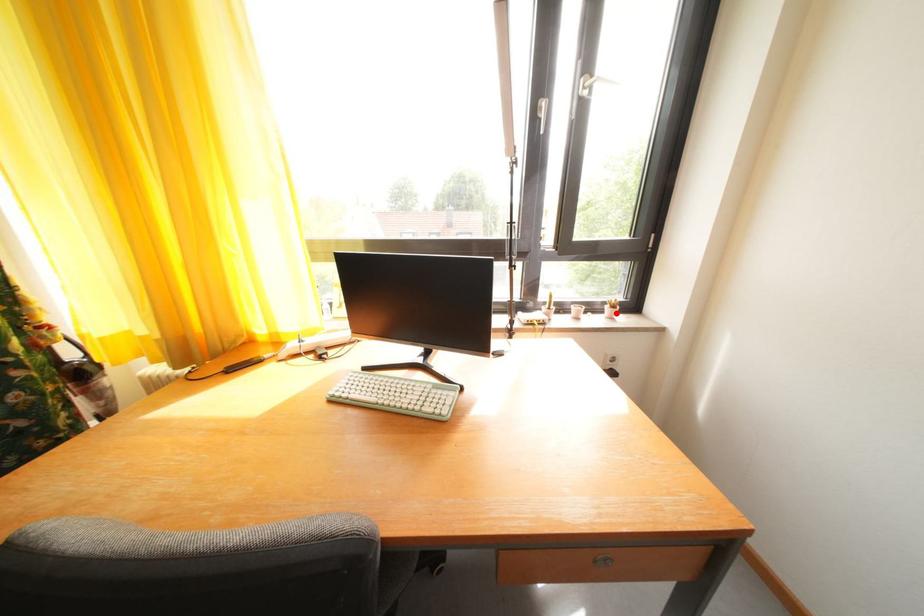
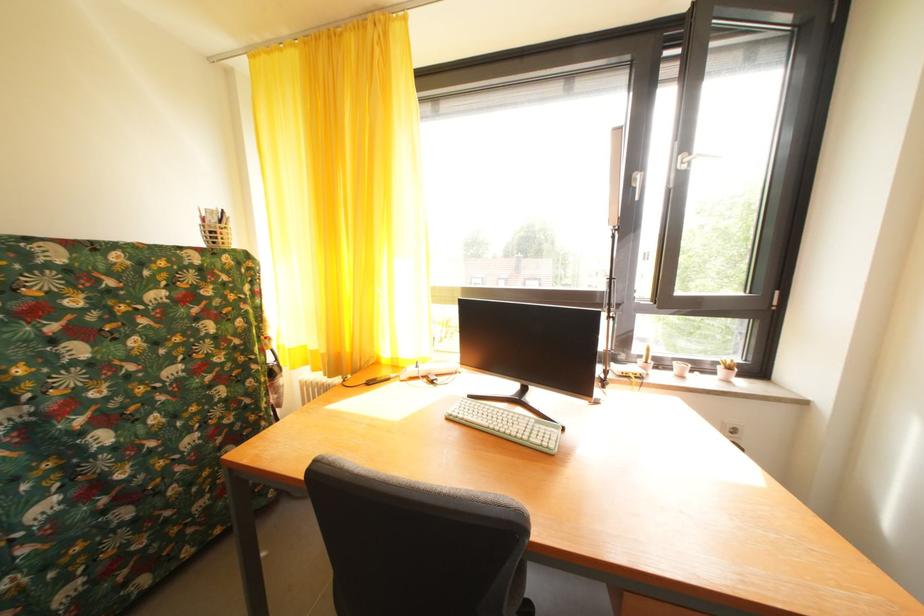
Find the pixel in the second image that matches the highlighted location in the first image.

(728, 374)